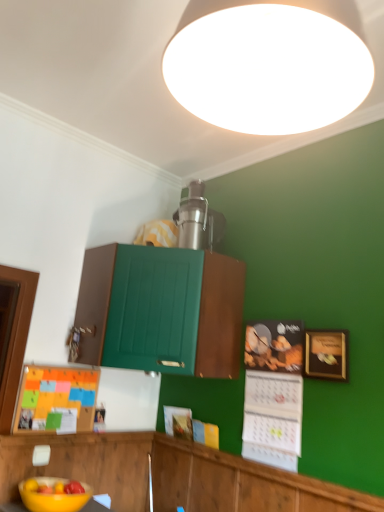
Question: Is matte black calendar at lower right, acting as the 1th bulletin board starting from the right, at the right side of burlap bulletin board at lower left, acting as the 1th bulletin board starting from the left?

Choices:
 (A) no
 (B) yes

Answer: (B)

Question: From a real-world perspective, does matte black calendar at lower right, the second bulletin board viewed from the left, sit lower than burlap bulletin board at lower left, the 2th bulletin board positioned from the right?

Choices:
 (A) no
 (B) yes

Answer: (A)

Question: Is matte black calendar at lower right, the second bulletin board viewed from the left, turned away from burlap bulletin board at lower left, acting as the 1th bulletin board starting from the left?

Choices:
 (A) no
 (B) yes

Answer: (A)

Question: Does matte black calendar at lower right, acting as the 1th bulletin board starting from the right, come behind burlap bulletin board at lower left, the 2th bulletin board positioned from the right?

Choices:
 (A) yes
 (B) no

Answer: (B)

Question: Is matte black calendar at lower right, the second bulletin board viewed from the left, facing towards burlap bulletin board at lower left, acting as the 1th bulletin board starting from the left?

Choices:
 (A) yes
 (B) no

Answer: (B)

Question: Can you confirm if matte black calendar at lower right, the second bulletin board viewed from the left, is positioned to the left of burlap bulletin board at lower left, the 2th bulletin board positioned from the right?

Choices:
 (A) yes
 (B) no

Answer: (B)

Question: From the image's perspective, is yellow matte bowl at lower left under yellow matte bowl at lower left?

Choices:
 (A) no
 (B) yes

Answer: (A)

Question: Is yellow matte bowl at lower left positioned behind yellow matte bowl at lower left?

Choices:
 (A) yes
 (B) no

Answer: (A)

Question: Would you say yellow matte bowl at lower left is outside yellow matte bowl at lower left?

Choices:
 (A) no
 (B) yes

Answer: (B)

Question: Could yellow matte bowl at lower left be considered to be inside yellow matte bowl at lower left?

Choices:
 (A) no
 (B) yes

Answer: (A)

Question: Is yellow matte bowl at lower left aimed at yellow matte bowl at lower left?

Choices:
 (A) no
 (B) yes

Answer: (A)

Question: Considering the relative positions of yellow matte bowl at lower left and yellow matte bowl at lower left in the image provided, is yellow matte bowl at lower left to the left of yellow matte bowl at lower left from the viewer's perspective?

Choices:
 (A) no
 (B) yes

Answer: (B)

Question: Is yellow matte bowl at lower left next to gold-framed picture at right and touching it?

Choices:
 (A) no
 (B) yes

Answer: (A)